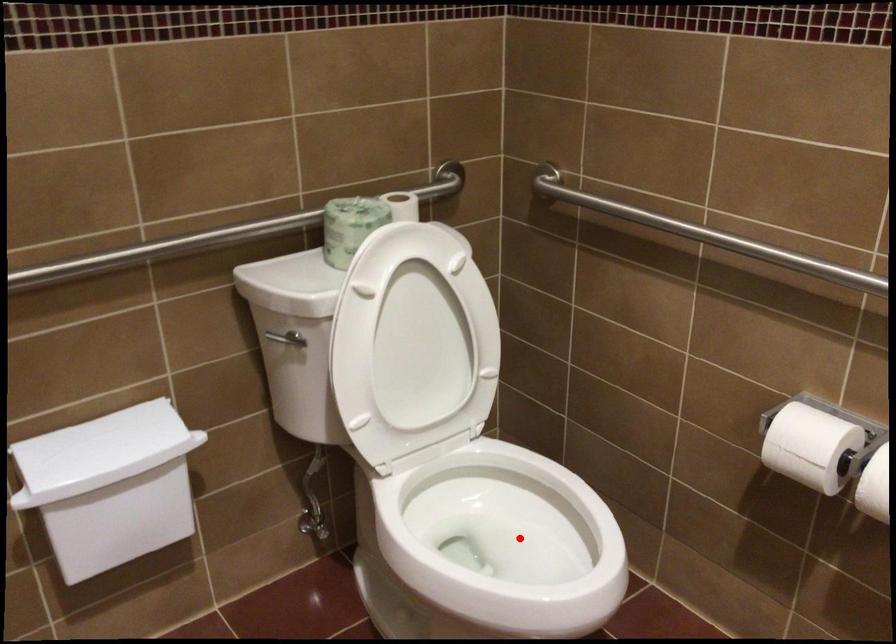
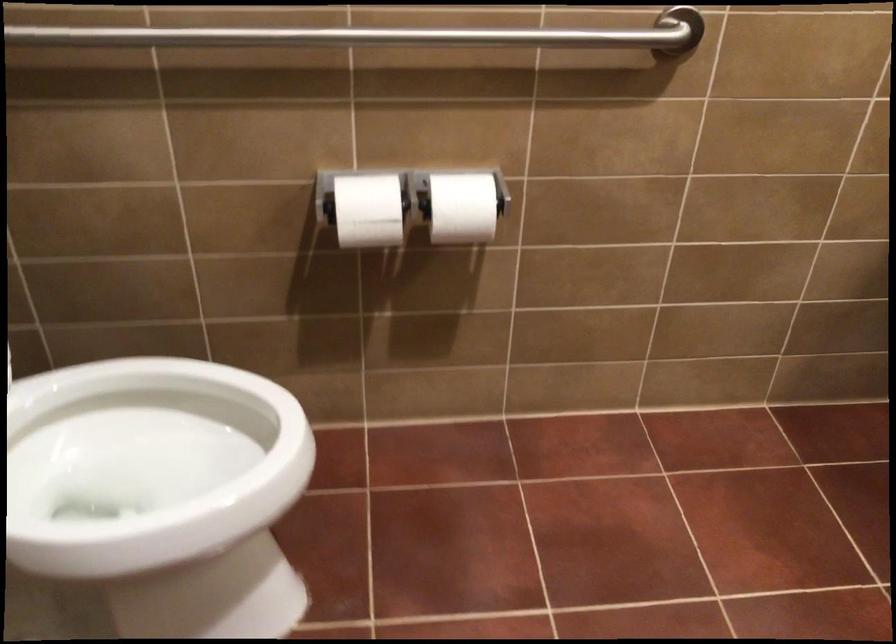
Find the pixel in the second image that matches the highlighted location in the first image.

(147, 464)